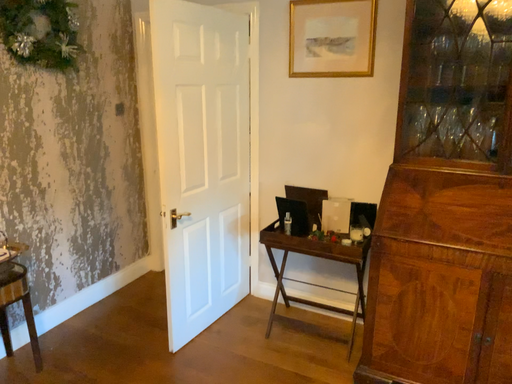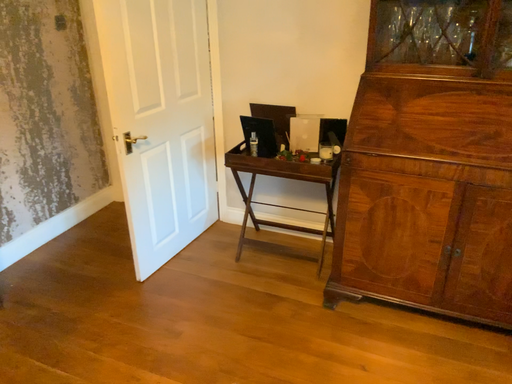
Question: Which way did the camera rotate in the video?

Choices:
 (A) rotated upward
 (B) rotated downward

Answer: (B)